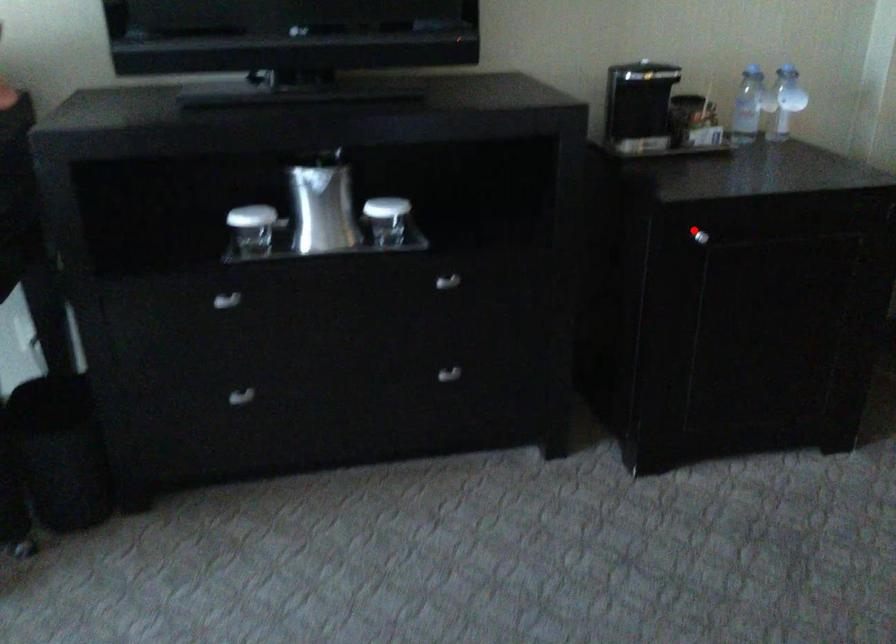
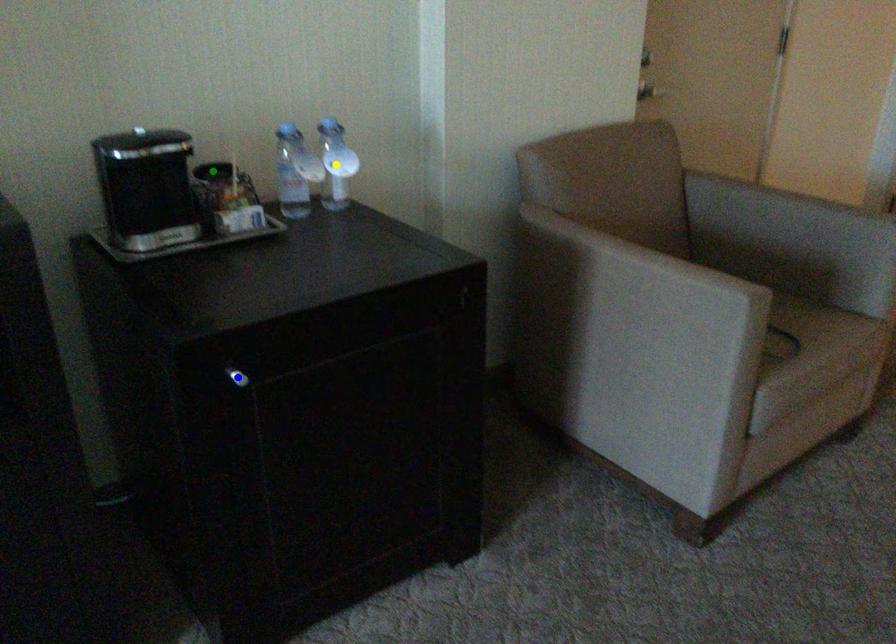
Question: I am providing you with two images of the same scene from different viewpoints. A red point is marked on the first image. You are given multiple points on the second image. Which mark in image 2 goes with the point in image 1?

Choices:
 (A) blue point
 (B) green point
 (C) yellow point

Answer: (A)